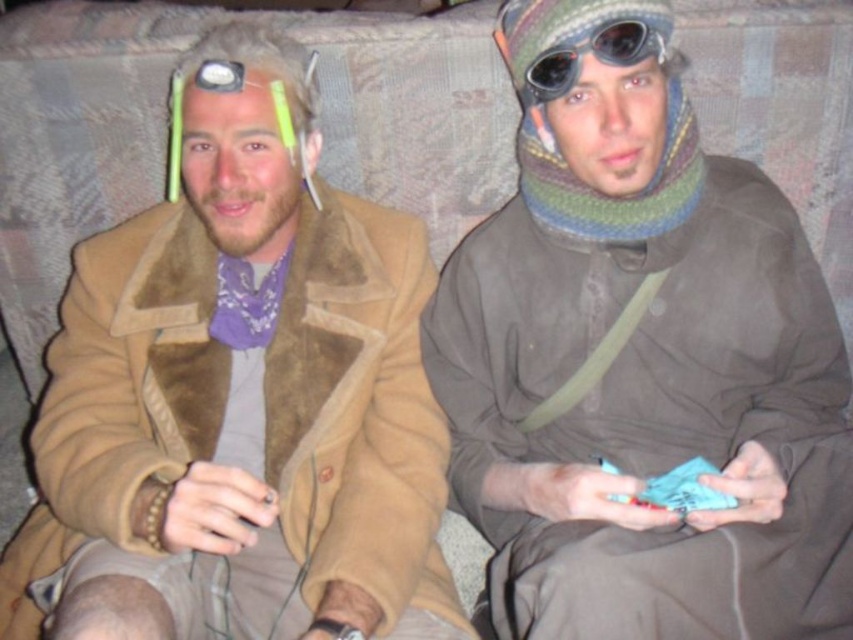
Question: Does multicolored knitted scarf at center appear over black rubber goggles at upper center?

Choices:
 (A) yes
 (B) no

Answer: (B)

Question: Which of these objects is positioned closest to the brown suede jacket at left?

Choices:
 (A) multicolored knitted scarf at center
 (B) black rubber goggles at upper center

Answer: (A)

Question: Among these objects, which one is nearest to the camera?

Choices:
 (A) brown suede jacket at left
 (B) multicolored knitted scarf at center

Answer: (A)

Question: Which point is farther to the camera?

Choices:
 (A) black rubber goggles at upper center
 (B) brown suede jacket at left
 (C) multicolored knitted scarf at center

Answer: (A)

Question: Is multicolored knitted scarf at center to the left of black rubber goggles at upper center from the viewer's perspective?

Choices:
 (A) no
 (B) yes

Answer: (A)

Question: Does brown suede jacket at left appear on the left side of black rubber goggles at upper center?

Choices:
 (A) yes
 (B) no

Answer: (A)